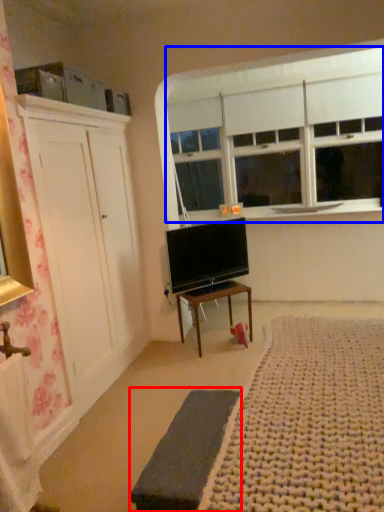
Question: Which object is closer to the camera taking this photo, bed frame (highlighted by a red box) or window (highlighted by a blue box)?

Choices:
 (A) bed frame
 (B) window

Answer: (A)